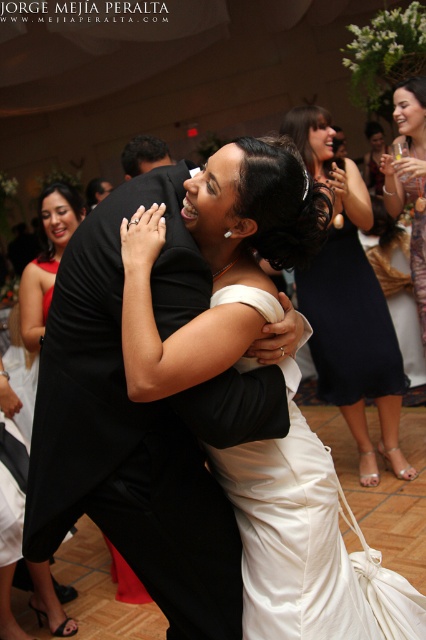
Question: Which point is closer to the camera?

Choices:
 (A) black satin suit at upper left
 (B) matte gold necklace at upper right
 (C) satin black dress at upper right
 (D) satin white dress at center

Answer: (D)

Question: Which point is closer to the camera?

Choices:
 (A) satin black dress at upper right
 (B) black satin suit at upper left

Answer: (A)

Question: Estimate the real-world distances between objects in this image. Which object is farther from the matte black dress at left?

Choices:
 (A) satin black dress at upper right
 (B) black satin suit at center
 (C) matte gold necklace at upper right

Answer: (B)

Question: Considering the relative positions of satin black dress at upper right and black satin suit at center in the image provided, where is satin black dress at upper right located with respect to black satin suit at center?

Choices:
 (A) above
 (B) below

Answer: (B)

Question: Is satin white dress at center to the left of black satin suit at center from the viewer's perspective?

Choices:
 (A) no
 (B) yes

Answer: (A)

Question: Is satin white dress at center wider than matte black dress at left?

Choices:
 (A) no
 (B) yes

Answer: (B)